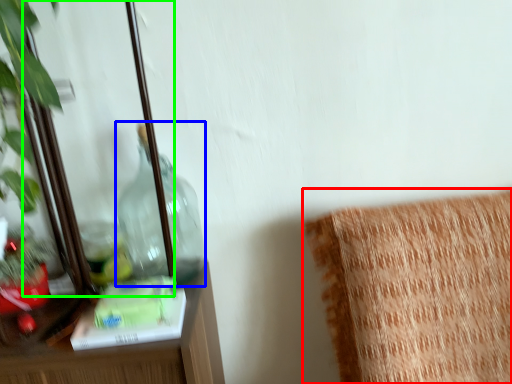
Question: Based on their relative distances, which object is farther from furniture (highlighted by a red box)? Choose from bottle (highlighted by a blue box) and mirror (highlighted by a green box).

Choices:
 (A) bottle
 (B) mirror

Answer: (B)